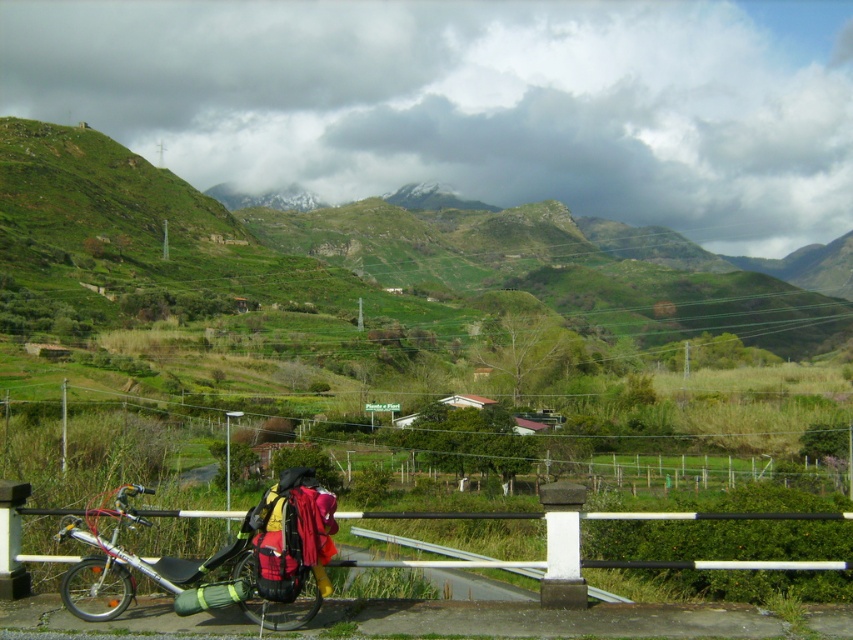
You are standing on the bridge looking down at the metallic silver bicycle at lower left and the white metal rail at lower left. Which object is positioned higher from the ground?

The metallic silver bicycle at lower left is positioned higher from the ground than the white metal rail at lower left because the metallic silver bicycle at lower left is above the white metal rail at lower left.

In the scene shown: You are a cyclist who just arrived at the bridge and wants to park your metallic silver bicycle at lower left. The bridge has a white metal rail at lower left that you need to consider. Can your bicycle fit between the rail and the edge of the bridge? Please explain.

The metallic silver bicycle at lower left is narrower than the white metal rail at lower left. Since the bicycle is narrower than the rail, it can fit between the rail and the edge of the bridge.

You are standing at the point closer to the camera between the two points, point (62, 538) and point (743, 516). Looking towards the distant landscape, which direction would you face to see the signpost mentioned in the scene?

Since point (62, 538) is closer to the camera than point (743, 516), standing at point (62, 538), you would face towards the direction of the signpost. The signpost is located in the middle ground near the small buildings among the vegetation.